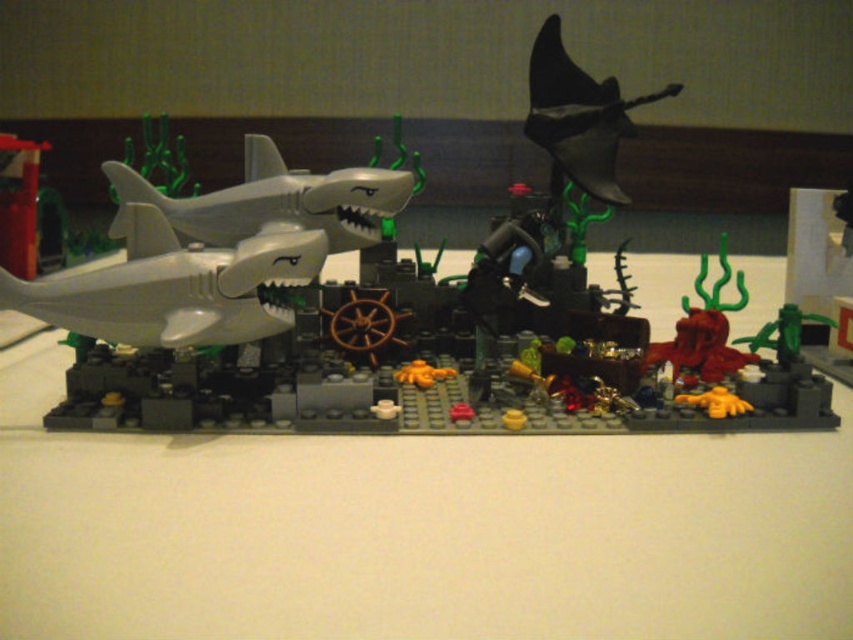
Question: Which point is closer to the camera?

Choices:
 (A) pyautogui.click(x=230, y=317)
 (B) pyautogui.click(x=651, y=93)
 (C) pyautogui.click(x=131, y=202)

Answer: (A)

Question: Estimate the real-world distances between objects in this image. Which object is farther from the white matte shark at left?

Choices:
 (A) matte gray shark at center
 (B) black matte plane at upper center

Answer: (B)

Question: Which object is closer to the camera taking this photo?

Choices:
 (A) black matte plane at upper center
 (B) matte gray shark at center
 (C) white matte shark at left
 (D) matte gray shark at left

Answer: (D)

Question: Is matte gray shark at center above matte gray shark at left?

Choices:
 (A) no
 (B) yes

Answer: (B)

Question: Is matte gray shark at center smaller than black matte plane at upper center?

Choices:
 (A) no
 (B) yes

Answer: (A)

Question: Is matte gray shark at center smaller than white matte shark at left?

Choices:
 (A) no
 (B) yes

Answer: (A)